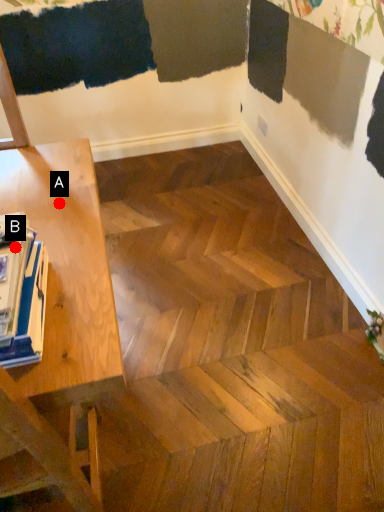
Question: Two points are circled on the image, labeled by A and B beside each circle. Which point is closer to the camera taking this photo?

Choices:
 (A) A is closer
 (B) B is closer

Answer: (B)